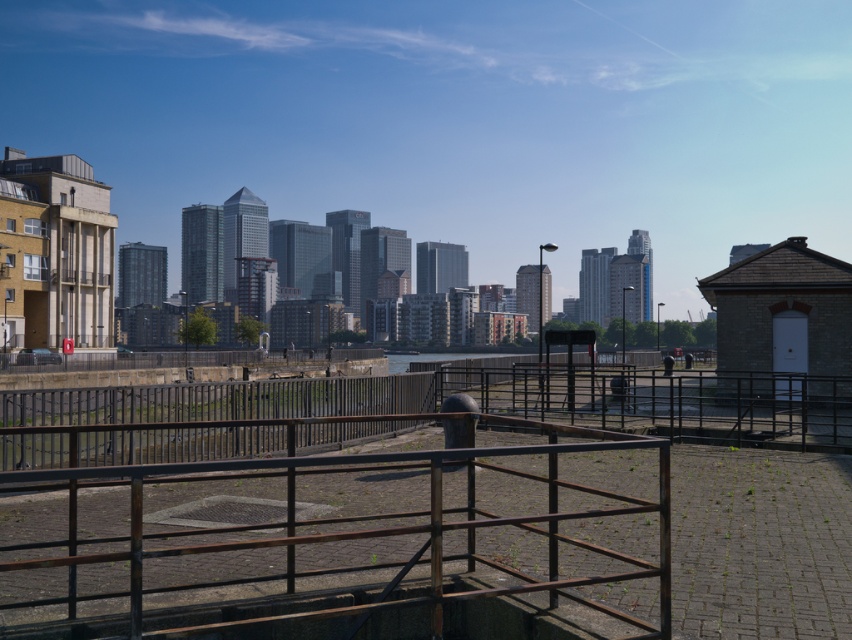
Question: In this image, where is rusty metal rail at center located relative to rusty metal fence at center?

Choices:
 (A) below
 (B) above

Answer: (B)

Question: Is rusty metal rail at center closer to camera compared to rusty metal fence at center?

Choices:
 (A) no
 (B) yes

Answer: (B)

Question: Which object is closer to the camera taking this photo?

Choices:
 (A) rusty metal rail at center
 (B) rusty metal fence at center

Answer: (A)

Question: Which of the following is the closest to the observer?

Choices:
 (A) rusty metal rail at center
 (B) rusty metal fence at center

Answer: (A)

Question: Does rusty metal rail at center appear over rusty metal fence at center?

Choices:
 (A) no
 (B) yes

Answer: (B)

Question: Which point is closer to the camera?

Choices:
 (A) (234, 499)
 (B) (214, 445)

Answer: (A)